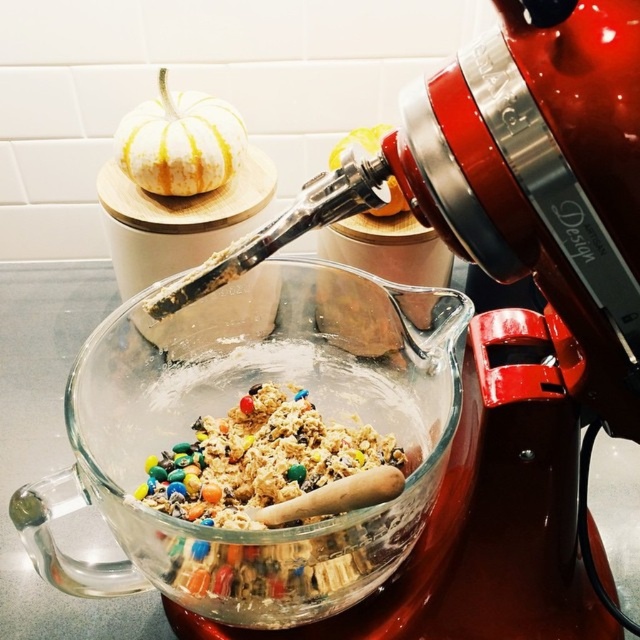
Does transparent glass bowl at center have a larger size compared to multicolored crunchy cookie dough at center?

Yes, transparent glass bowl at center is bigger than multicolored crunchy cookie dough at center.

Can you confirm if transparent glass bowl at center is positioned to the right of multicolored crunchy cookie dough at center?

No, transparent glass bowl at center is not to the right of multicolored crunchy cookie dough at center.

Identify the location of transparent glass bowl at center. [x=227, y=406].

Find the location of `transparent glass bowl at center`. transparent glass bowl at center is located at coordinates (227, 406).

Is multicolored crunchy cookie dough at center below white matte pumpkin at upper left?

Indeed, multicolored crunchy cookie dough at center is positioned under white matte pumpkin at upper left.

Measure the distance between multicolored crunchy cookie dough at center and white matte pumpkin at upper left.

multicolored crunchy cookie dough at center is 6.28 inches away from white matte pumpkin at upper left.

Between point (387, 476) and point (168, 161), which one is positioned in front?

Positioned in front is point (387, 476).

This screenshot has width=640, height=640. I want to click on multicolored crunchy cookie dough at center, so click(273, 465).

Who is higher up, transparent glass bowl at center or white matte pumpkin at upper left?

Positioned higher is white matte pumpkin at upper left.

Looking at this image, can you confirm if transparent glass bowl at center is positioned to the left of white matte pumpkin at upper left?

No, transparent glass bowl at center is not to the left of white matte pumpkin at upper left.

Is point (230, 292) positioned in front of point (163, 161)?

Yes.

You are a GUI agent. You are given a task and a screenshot of the screen. Output one action in this format:
    pyautogui.click(x=<x>, y=<y>)
    Task: Click on the transparent glass bowl at center
    
    Given the screenshot: What is the action you would take?
    pyautogui.click(x=227, y=406)